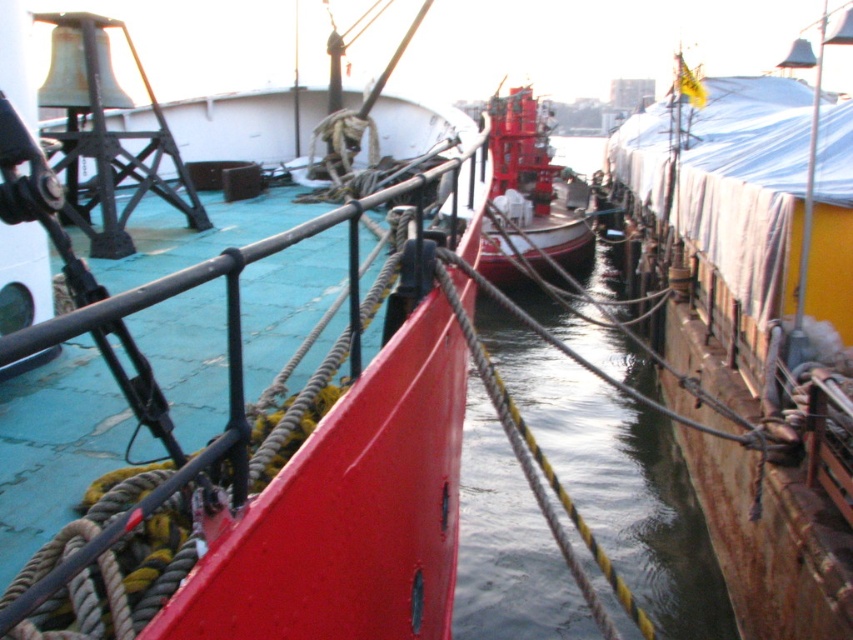
Is smooth red boat at center bigger than shiny red boat at center?

Actually, smooth red boat at center might be smaller than shiny red boat at center.

Can you confirm if smooth red boat at center is smaller than shiny red boat at center?

Correct, smooth red boat at center occupies less space than shiny red boat at center.

Between point (270, 636) and point (540, 243), which one is positioned behind?

Point (540, 243)

This screenshot has height=640, width=853. I want to click on smooth red boat at center, so click(311, 472).

Does rusty metal boat at right have a smaller size compared to smooth red boat at center?

Actually, rusty metal boat at right might be larger than smooth red boat at center.

Between point (706, 525) and point (360, 404), which one is positioned behind?

The point (706, 525) is behind.

You are a GUI agent. You are given a task and a screenshot of the screen. Output one action in this format:
    pyautogui.click(x=<x>, y=<y>)
    Task: Click on the rusty metal boat at right
    This screenshot has height=640, width=853.
    Given the screenshot: What is the action you would take?
    pyautogui.click(x=755, y=332)

Describe the element at coordinates (755, 332) in the screenshot. I see `rusty metal boat at right` at that location.

You are a GUI agent. You are given a task and a screenshot of the screen. Output one action in this format:
    pyautogui.click(x=<x>, y=<y>)
    Task: Click on the rusty metal boat at right
    Image resolution: width=853 pixels, height=640 pixels.
    Given the screenshot: What is the action you would take?
    pyautogui.click(x=755, y=332)

Where is `rusty metal boat at right`? The width and height of the screenshot is (853, 640). rusty metal boat at right is located at coordinates (755, 332).

Identify the location of rusty metal boat at right. This screenshot has width=853, height=640. (755, 332).